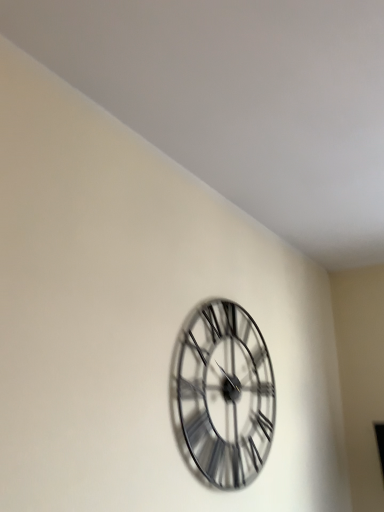
What do you see at coordinates (223, 394) in the screenshot?
I see `metallic silver clock at center` at bounding box center [223, 394].

Where is `metallic silver clock at center`? The width and height of the screenshot is (384, 512). metallic silver clock at center is located at coordinates (223, 394).

You are a GUI agent. You are given a task and a screenshot of the screen. Output one action in this format:
    pyautogui.click(x=<x>, y=<y>)
    Task: Click on the metallic silver clock at center
    This screenshot has width=384, height=512.
    Given the screenshot: What is the action you would take?
    pyautogui.click(x=223, y=394)